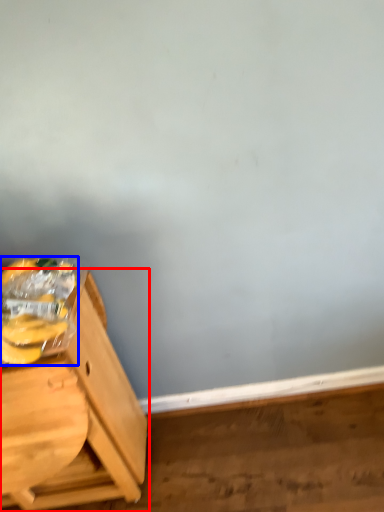
Question: Which object appears closest to the camera in this image, furniture (highlighted by a red box) or banana (highlighted by a blue box)?

Choices:
 (A) furniture
 (B) banana

Answer: (B)